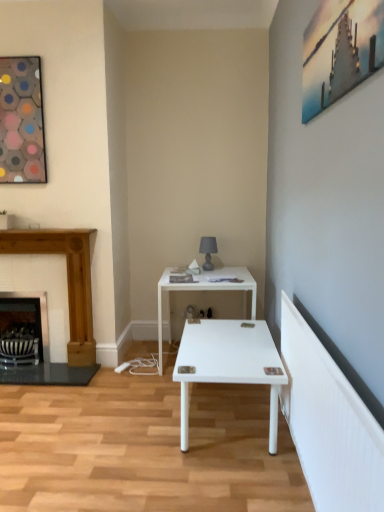
Question: Does point (18, 331) appear closer or farther from the camera than point (206, 252)?

Choices:
 (A) closer
 (B) farther

Answer: (A)

Question: Is black metal fireplace at left, the 1th fireplace when ordered from left to right, taller or shorter than matte gray glass table lamp at center?

Choices:
 (A) short
 (B) tall

Answer: (B)

Question: Which of these objects is positioned farthest from the metallic silver swivel chair at lower left?

Choices:
 (A) black metal fireplace at left, the 2th fireplace from the right
 (B) white glossy table at center
 (C) hexagonal mosaic art at upper left, the 1th picture frame viewed from the left
 (D) matte gray glass table lamp at center
 (E) wooden fireplace at left, which ranks as the 1th fireplace in right-to-left order

Answer: (D)

Question: Which of these objects is positioned closest to the metallic silver picture frame at upper right, the first picture frame positioned from the right?

Choices:
 (A) black metal fireplace at left, the 2th fireplace from the right
 (B) white glossy table at center
 (C) metallic silver swivel chair at lower left
 (D) hexagonal mosaic art at upper left, the first picture frame viewed from the back
 (E) wooden fireplace at left, which ranks as the 1th fireplace in right-to-left order

Answer: (B)